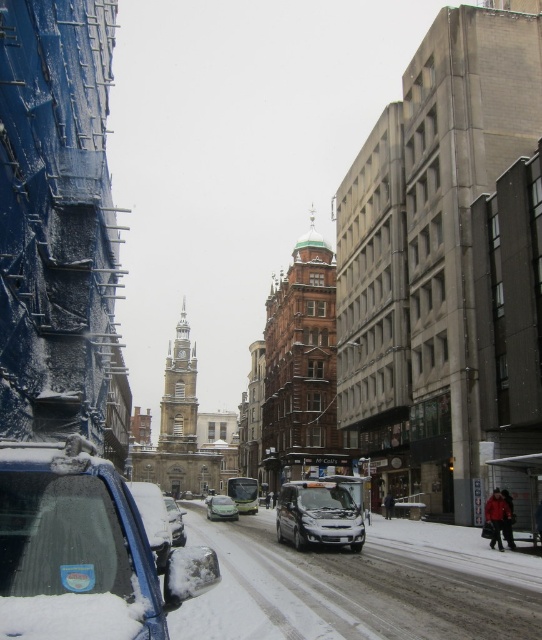
You are a delivery driver who needs to park your vehicle in this snowy street scene. The parking spot is at point (319, 515). Can you safely park your car there?

The satin black car at center is already located at point (319, 515), so the parking spot is occupied and you cannot park there.

You are a delivery driver needing to park your vehicle between the green matte car at center and the silver metallic sedan at center. Which side should you park on to ensure you are between them?

You should park to the left of the green matte car at center because it is positioned to the right of the silver metallic sedan at center, so placing your vehicle between them would require positioning it between the left side of the green matte car at center and the right side of the silver metallic sedan at center.